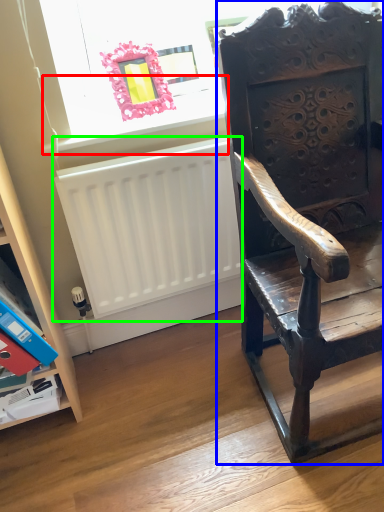
Question: Based on their relative distances, which object is farther from window sill (highlighted by a red box)? Choose from chair (highlighted by a blue box) and radiator (highlighted by a green box).

Choices:
 (A) chair
 (B) radiator

Answer: (A)